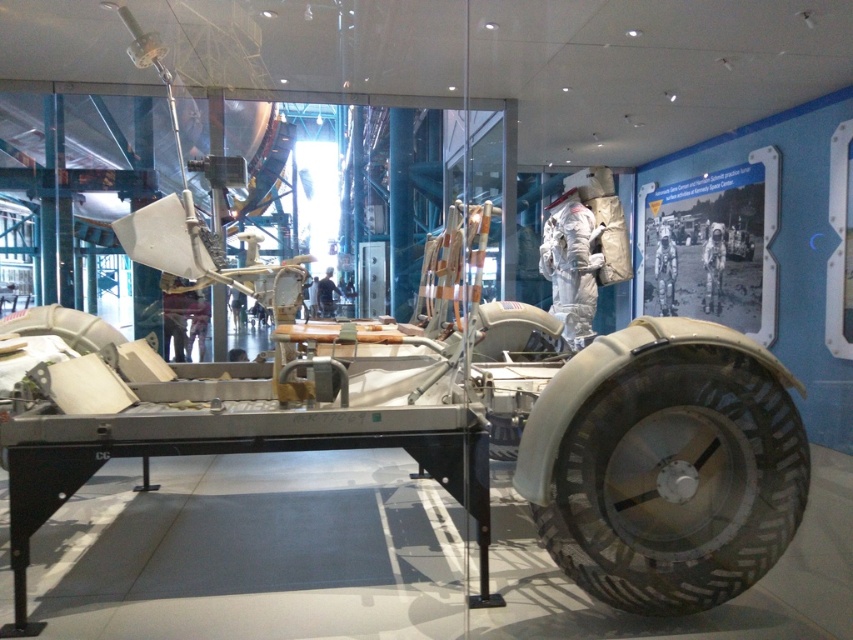
From the picture: You are standing at the camera position in the exhibit and want to take a photo of the lunar rover. The exhibit has a rule that you must be at least 10 feet away from any object to take a photo. Is the point at coordinates point (694, 452) within the allowed distance for photography?

The point at coordinates point (694, 452) is only 8.56 feet away from the camera position, which is less than the required 10 feet. Therefore, you cannot take a photo of the lunar rover from this position as it violates the exhibit rule.

You are an astronaut preparing for a moonwalk and need to ensure your equipment is properly positioned. Given the rubber textured tire at lower right and the white spacesuit at center, which object is bigger in size?

The rubber textured tire at lower right has a larger size compared to the white spacesuit at center, so the rubber textured tire at lower right is bigger.

You are an astronaut preparing to board the lunar rover displayed in the museum. You notice the rubber textured tire at lower right and the black fabric man at center. Which object is nearer to you as you stand in front of the exhibit?

The rubber textured tire at lower right is closer to the viewer than the black fabric man at center, so the rubber textured tire at lower right is nearer to you.